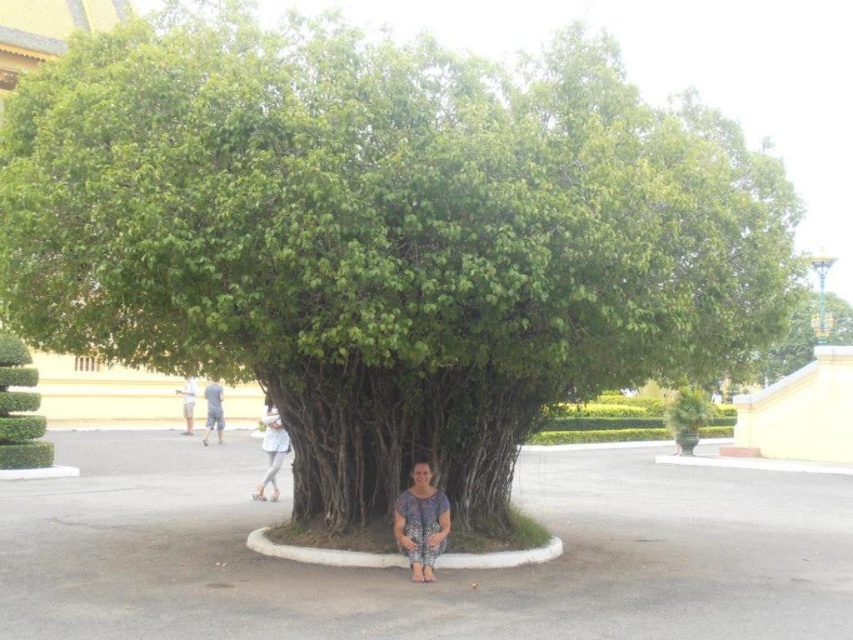
Question: Which point is farther to the camera?

Choices:
 (A) white cotton shirt at center
 (B) printed fabric squat at center
 (C) gray fabric squat at center

Answer: (C)

Question: Can you confirm if white cotton shirt at center is smaller than gray fabric squat at center?

Choices:
 (A) no
 (B) yes

Answer: (B)

Question: Can you confirm if printed fabric squat at center is bigger than white cotton shirt at center?

Choices:
 (A) no
 (B) yes

Answer: (A)

Question: Among these objects, which one is farthest from the camera?

Choices:
 (A) gray fabric squat at center
 (B) white cotton shirt at center
 (C) printed fabric squat at center

Answer: (A)

Question: Does printed fabric squat at center appear on the left side of white cotton shirt at center?

Choices:
 (A) no
 (B) yes

Answer: (A)

Question: Estimate the real-world distances between objects in this image. Which object is closer to the gray fabric squat at center?

Choices:
 (A) printed fabric squat at center
 (B) white cotton shirt at center

Answer: (B)